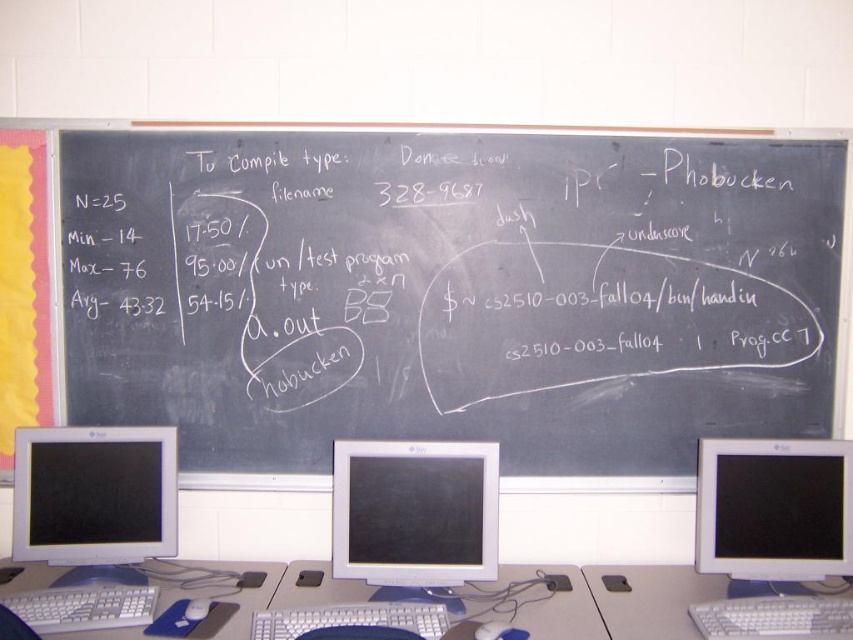
Question: Is black chalkboard at center above white glossy monitor at center?

Choices:
 (A) yes
 (B) no

Answer: (A)

Question: Among these objects, which one is nearest to the camera?

Choices:
 (A) white plastic table at lower right
 (B) matte white monitor at center

Answer: (A)

Question: Can you confirm if white plastic table at center is thinner than white plastic keyboard at lower right?

Choices:
 (A) no
 (B) yes

Answer: (B)

Question: Which point appears farthest from the camera in this image?

Choices:
 (A) (786, 444)
 (B) (201, 600)
 (C) (645, 632)

Answer: (A)

Question: Which object is positioned closest to the matte black mouse at center?

Choices:
 (A) matte white monitor at center
 (B) black chalkboard at center
 (C) matte white monitor at left
 (D) white plastic keyboard at lower left

Answer: (D)

Question: Is white plastic table at lower right behind white plastic keyboard at lower left?

Choices:
 (A) no
 (B) yes

Answer: (B)